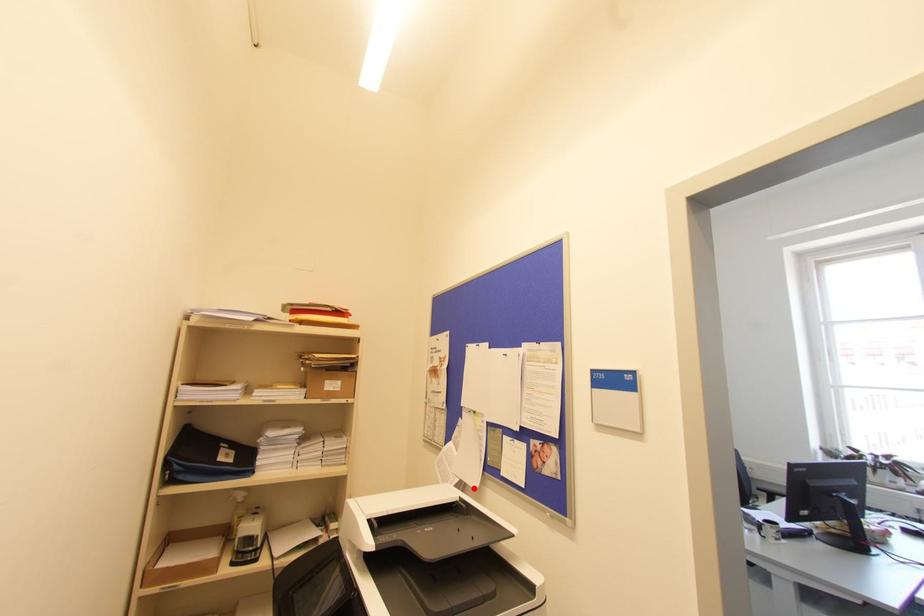
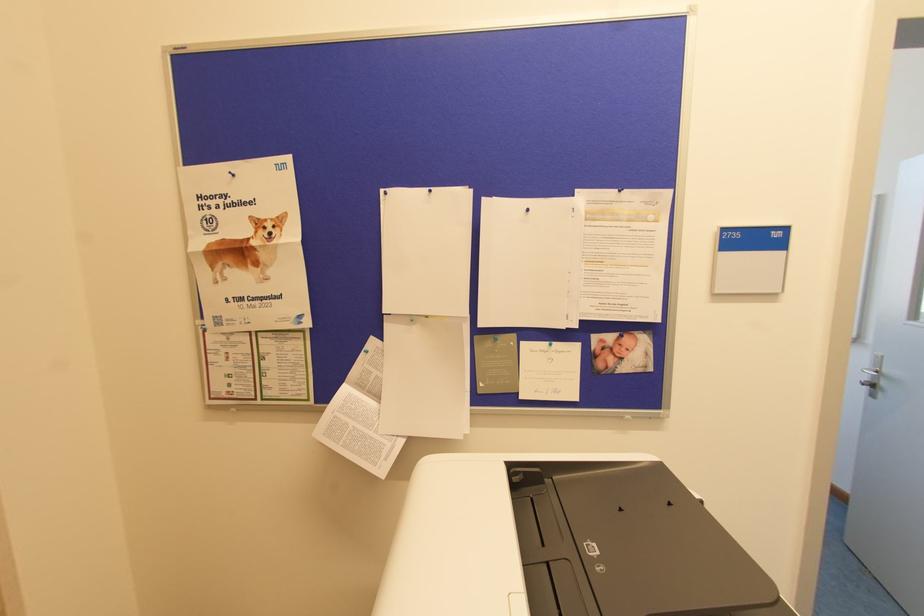
Locate, in the second image, the point that corresponds to the highlighted location in the first image.

(460, 438)